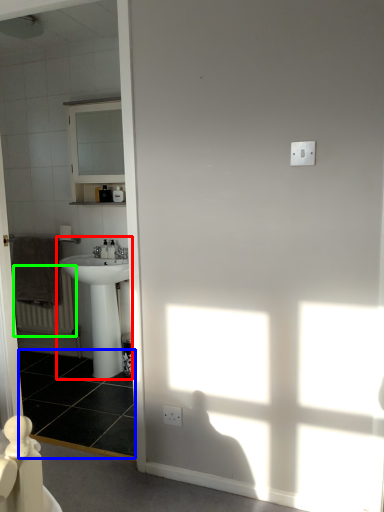
Question: Which object is the closest to the sink (highlighted by a red box)? Choose among these: tile (highlighted by a blue box) or radiator (highlighted by a green box).

Choices:
 (A) tile
 (B) radiator

Answer: (A)